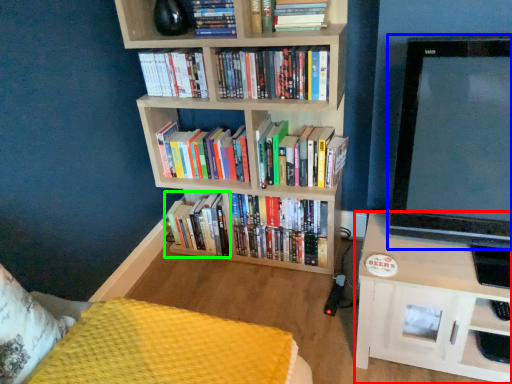
Question: Which object is the closest to the shelf (highlighted by a red box)? Choose among these: television (highlighted by a blue box) or book (highlighted by a green box).

Choices:
 (A) television
 (B) book

Answer: (A)